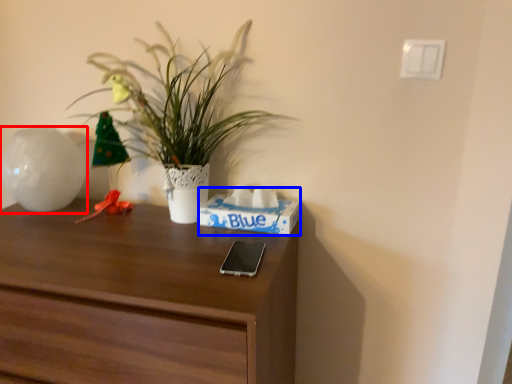
Question: Among these objects, which one is nearest to the camera, vase (highlighted by a red box) or shoe box (highlighted by a blue box)?

Choices:
 (A) vase
 (B) shoe box

Answer: (B)